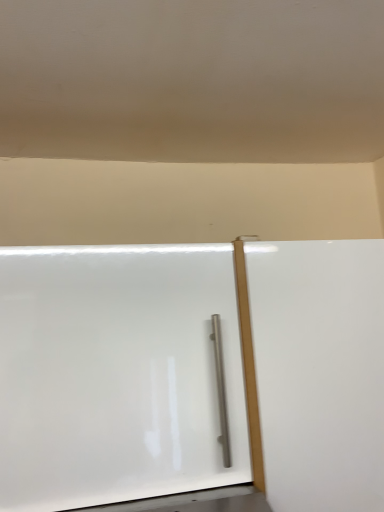
I want to click on white glossy screen door at center, so click(x=116, y=374).

The image size is (384, 512). What do you see at coordinates (116, 374) in the screenshot?
I see `white glossy screen door at center` at bounding box center [116, 374].

I want to click on white glossy screen door at center, so click(x=116, y=374).